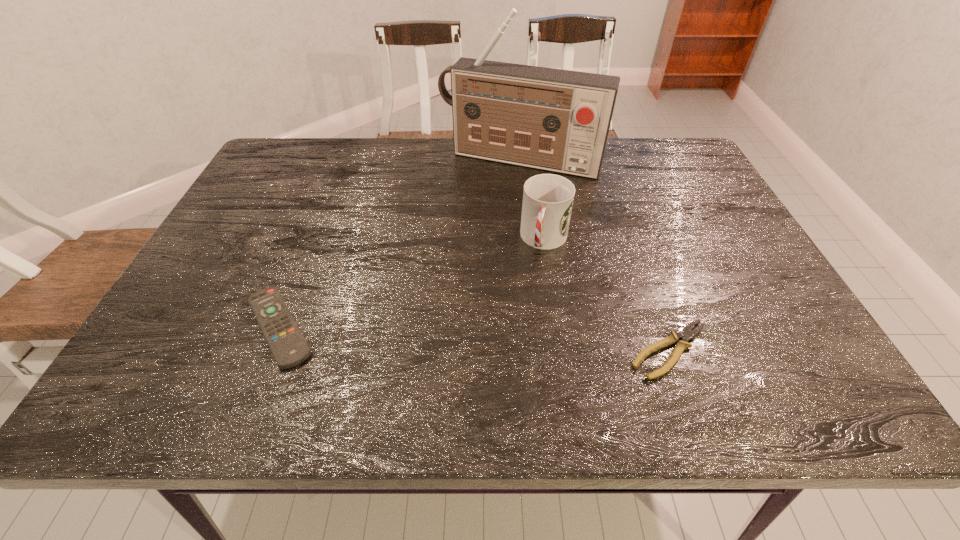
What are the coordinates of `vacant space at the far edge of the desktop` in the screenshot? It's located at (441, 165).

The width and height of the screenshot is (960, 540). Identify the location of free spot at the near edge of the desktop. (453, 348).

This screenshot has height=540, width=960. In the image, there is a desktop. Find the location of `vacant space at the right edge`. vacant space at the right edge is located at coordinates (742, 251).

The height and width of the screenshot is (540, 960). What are the coordinates of `free space at the near right corner of the desktop` in the screenshot? It's located at (737, 345).

Find the location of a particular element. blank region between the shortest object and the tallest object is located at coordinates (595, 255).

Locate an element on the screen. This screenshot has width=960, height=540. empty space that is in between the third tallest object and the third nearest object is located at coordinates (412, 284).

The width and height of the screenshot is (960, 540). I want to click on blank region between the farthest object and the pliers, so click(x=595, y=255).

The width and height of the screenshot is (960, 540). I want to click on vacant space that's between the pliers and the second farthest object, so click(608, 295).

Where is `vacant space that's between the farthest object and the shortest object`? This screenshot has height=540, width=960. vacant space that's between the farthest object and the shortest object is located at coordinates (595, 255).

Where is `empty space that is in between the shortest object and the tallest object`? empty space that is in between the shortest object and the tallest object is located at coordinates (595, 255).